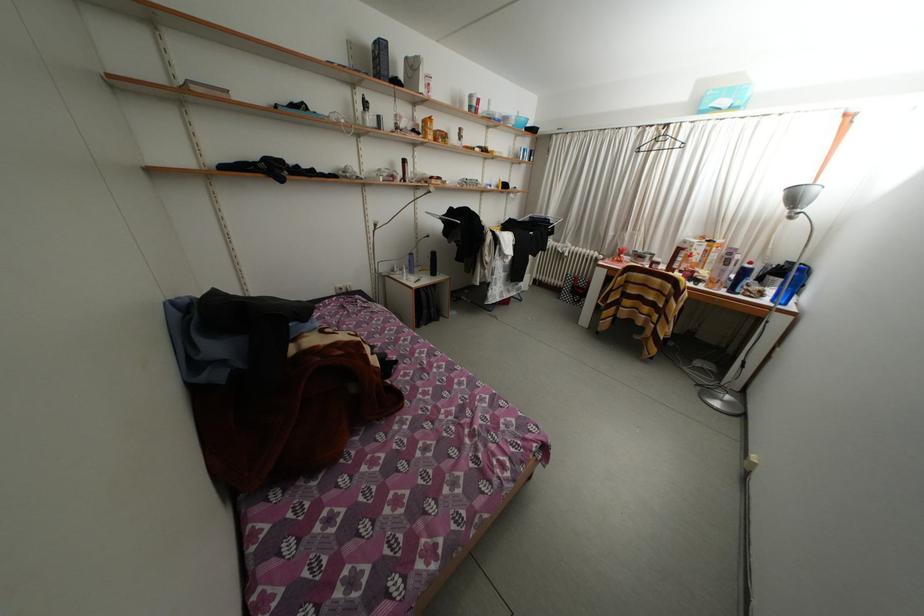
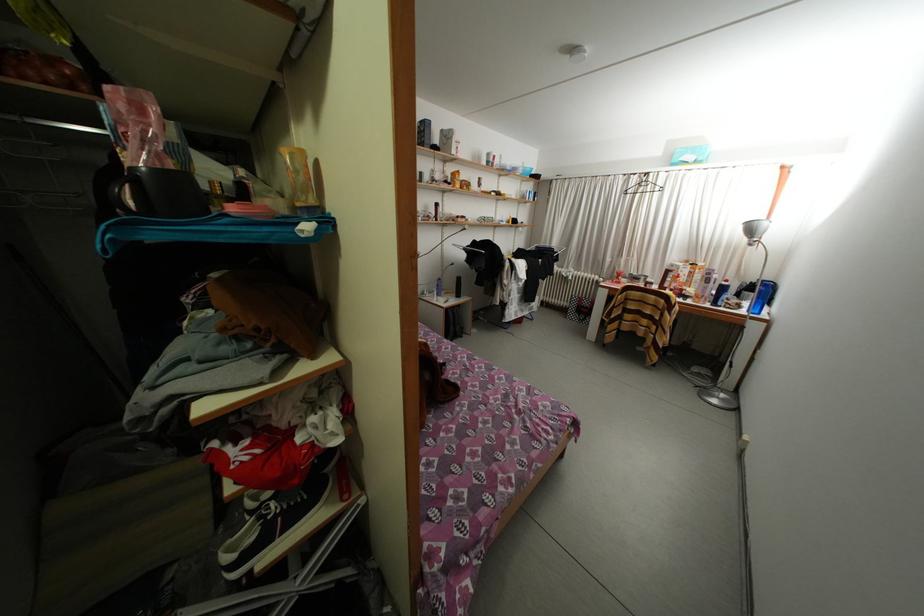
In the second image, find the point that corresponds to point (769, 299) in the first image.

(747, 310)